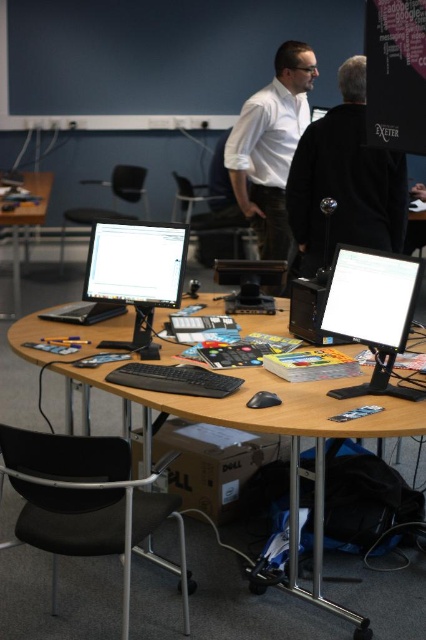
You are setting up a presentation and need to know which monitor has a larger screen to display your slides. Which one is wider between the matte black monitor at right and the matte black monitor at center?

The matte black monitor at center is wider than the matte black monitor at right, so you should use the matte black monitor at center for your presentation slides.